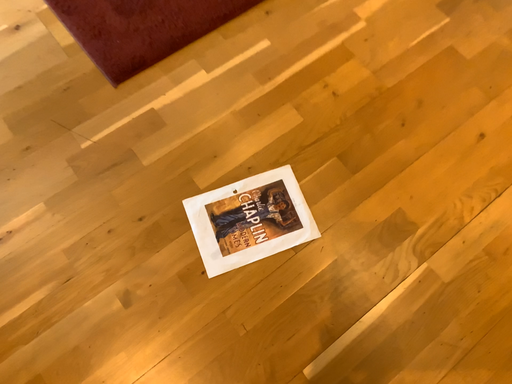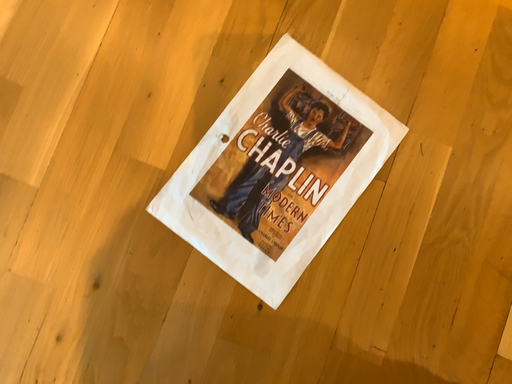
Question: Which way did the camera rotate in the video?

Choices:
 (A) rotated left
 (B) rotated right

Answer: (B)